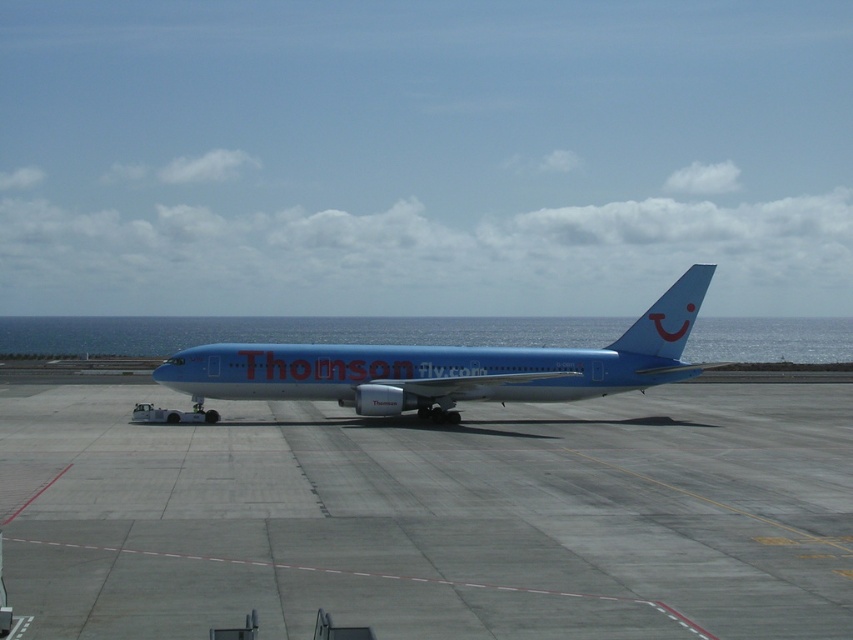
Question: From the image, what is the correct spatial relationship of smooth concrete tarmac at center in relation to blue glossy airplane at center?

Choices:
 (A) right
 (B) left

Answer: (B)

Question: Is smooth concrete tarmac at center to the right of blue glossy airplane at center from the viewer's perspective?

Choices:
 (A) no
 (B) yes

Answer: (A)

Question: Which of the following is the closest to the observer?

Choices:
 (A) smooth concrete tarmac at center
 (B) blue glossy airplane at center

Answer: (A)

Question: Can you confirm if smooth concrete tarmac at center is positioned to the left of blue glossy airplane at center?

Choices:
 (A) yes
 (B) no

Answer: (A)